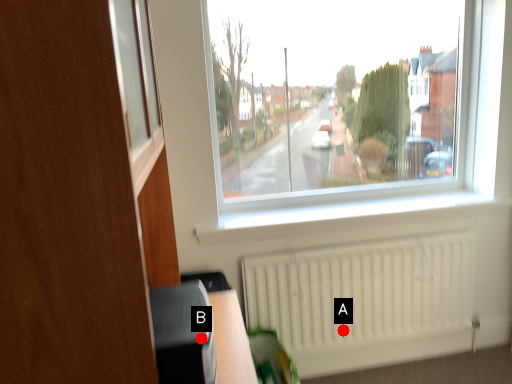
Question: Two points are circled on the image, labeled by A and B beside each circle. Among these points, which one is nearest to the camera?

Choices:
 (A) A is closer
 (B) B is closer

Answer: (B)